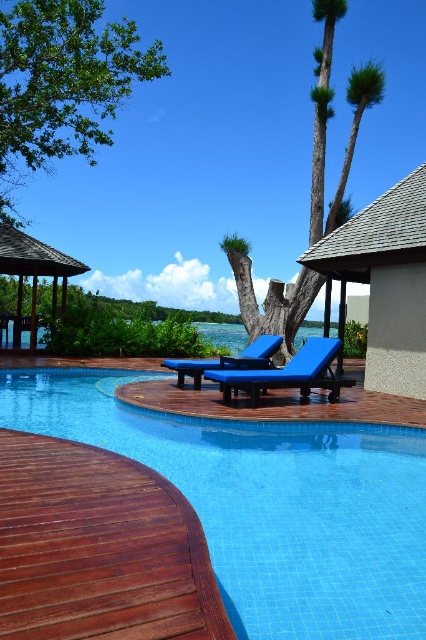
Does shiny brown wood at lower left appear on the left side of green leafy palm tree at center?

Indeed, shiny brown wood at lower left is positioned on the left side of green leafy palm tree at center.

Who is positioned more to the right, shiny brown wood at lower left or green leafy palm tree at center?

Positioned to the right is green leafy palm tree at center.

Locate an element on the screen. The width and height of the screenshot is (426, 640). shiny brown wood at lower left is located at coordinates (98, 548).

Does blue fabric chaise lounge at center appear over blue fabric lounge chair at center?

Actually, blue fabric chaise lounge at center is below blue fabric lounge chair at center.

Who is taller, blue fabric chaise lounge at center or blue fabric lounge chair at center?

blue fabric lounge chair at center is taller.

Which is in front, point (382, 397) or point (259, 344)?

Point (382, 397)

The width and height of the screenshot is (426, 640). Identify the location of blue fabric chaise lounge at center. (276, 404).

Is blue tile swimming pool at center bigger than shiny brown wood at lower left?

Incorrect, blue tile swimming pool at center is not larger than shiny brown wood at lower left.

Is point (285, 492) farther from viewer compared to point (192, 552)?

Yes, point (285, 492) is farther from viewer.

I want to click on blue tile swimming pool at center, so click(267, 502).